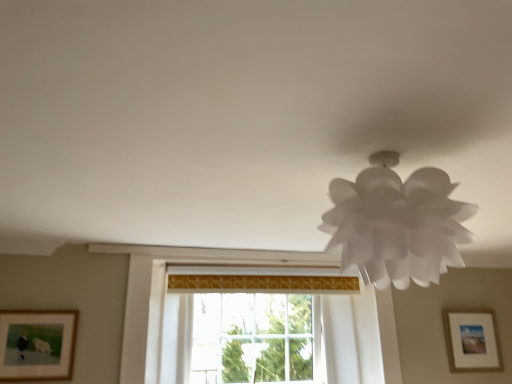
Question: Considering the relative positions of wooden framed picture at lower left, which ranks as the 2th picture frame in right-to-left order, and white paper lamp at upper right in the image provided, is wooden framed picture at lower left, which ranks as the 2th picture frame in right-to-left order, to the right of white paper lamp at upper right from the viewer's perspective?

Choices:
 (A) yes
 (B) no

Answer: (B)

Question: From the image's perspective, is wooden framed picture at lower left, which appears as the first picture frame when viewed from the left, located beneath white paper lamp at upper right?

Choices:
 (A) yes
 (B) no

Answer: (A)

Question: Considering the relative sizes of wooden framed picture at lower left, which appears as the first picture frame when viewed from the left, and white paper lamp at upper right in the image provided, is wooden framed picture at lower left, which appears as the first picture frame when viewed from the left, wider than white paper lamp at upper right?

Choices:
 (A) no
 (B) yes

Answer: (A)

Question: Can you confirm if wooden framed picture at lower left, which appears as the first picture frame when viewed from the left, is taller than white paper lamp at upper right?

Choices:
 (A) no
 (B) yes

Answer: (A)

Question: From a real-world perspective, is wooden framed picture at lower left, the first picture frame positioned from the front, on white paper lamp at upper right?

Choices:
 (A) yes
 (B) no

Answer: (B)

Question: From their relative heights in the image, would you say white paper lamp at upper right is taller or shorter than transparent glass window at center?

Choices:
 (A) tall
 (B) short

Answer: (B)

Question: From the image's perspective, relative to transparent glass window at center, is white paper lamp at upper right above or below?

Choices:
 (A) above
 (B) below

Answer: (A)

Question: Visually, is white paper lamp at upper right positioned to the left or to the right of transparent glass window at center?

Choices:
 (A) right
 (B) left

Answer: (A)

Question: Is white paper lamp at upper right bigger or smaller than transparent glass window at center?

Choices:
 (A) small
 (B) big

Answer: (A)

Question: From a real-world perspective, is wooden framed picture at lower left, marked as the 2th picture frame in a back-to-front arrangement, above or below transparent glass window at center?

Choices:
 (A) above
 (B) below

Answer: (B)

Question: In terms of width, does wooden framed picture at lower left, the first picture frame positioned from the front, look wider or thinner when compared to transparent glass window at center?

Choices:
 (A) thin
 (B) wide

Answer: (A)

Question: Would you say wooden framed picture at lower left, which ranks as the 2th picture frame in right-to-left order, is to the left or to the right of transparent glass window at center in the picture?

Choices:
 (A) right
 (B) left

Answer: (B)

Question: From the image's perspective, is wooden framed picture at lower left, marked as the 2th picture frame in a back-to-front arrangement, positioned above or below transparent glass window at center?

Choices:
 (A) above
 (B) below

Answer: (A)

Question: Is matte white picture frame at lower right, the second picture frame positioned from the front, wider or thinner than wooden framed picture at lower left, the first picture frame positioned from the front?

Choices:
 (A) thin
 (B) wide

Answer: (B)

Question: In terms of size, does matte white picture frame at lower right, positioned as the first picture frame in back-to-front order, appear bigger or smaller than wooden framed picture at lower left, marked as the 2th picture frame in a back-to-front arrangement?

Choices:
 (A) big
 (B) small

Answer: (A)